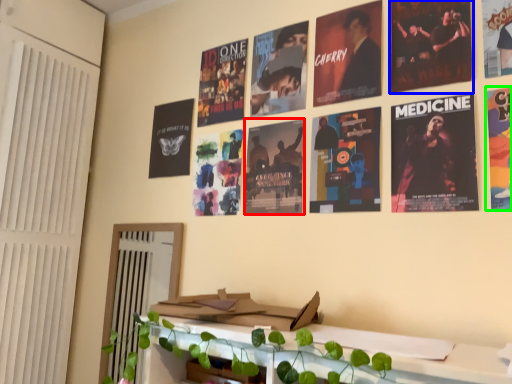
Question: Which object is the closest to the poster (highlighted by a red box)? Choose among these: poster (highlighted by a blue box) or poster (highlighted by a green box).

Choices:
 (A) poster
 (B) poster

Answer: (A)